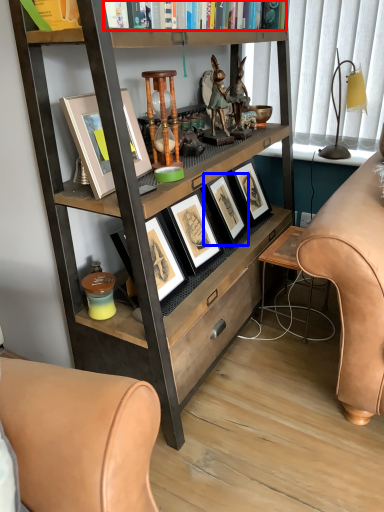
Question: Which of the following is the closest to the observer, book (highlighted by a red box) or picture frame (highlighted by a blue box)?

Choices:
 (A) book
 (B) picture frame

Answer: (A)